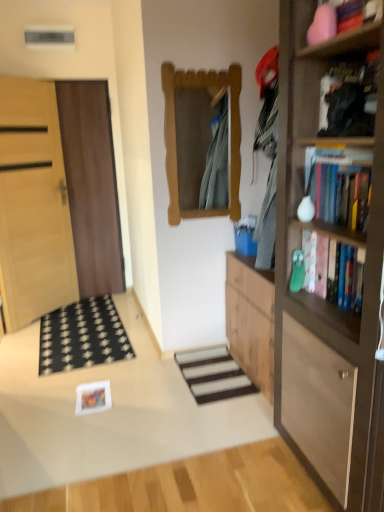
Identify the location of empty space that is ontop of white striped carpet at center (from a real-world perspective). This screenshot has height=512, width=384. (205, 369).